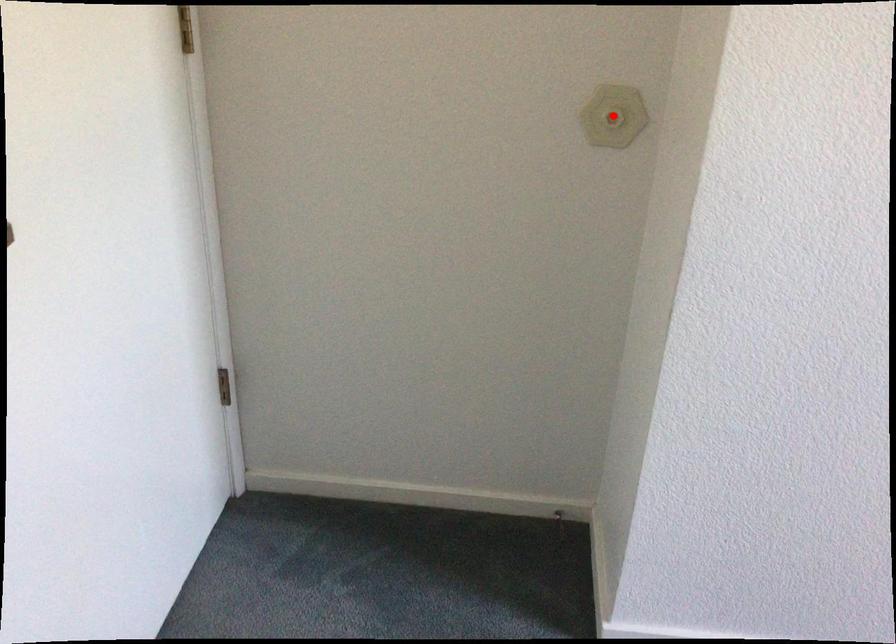
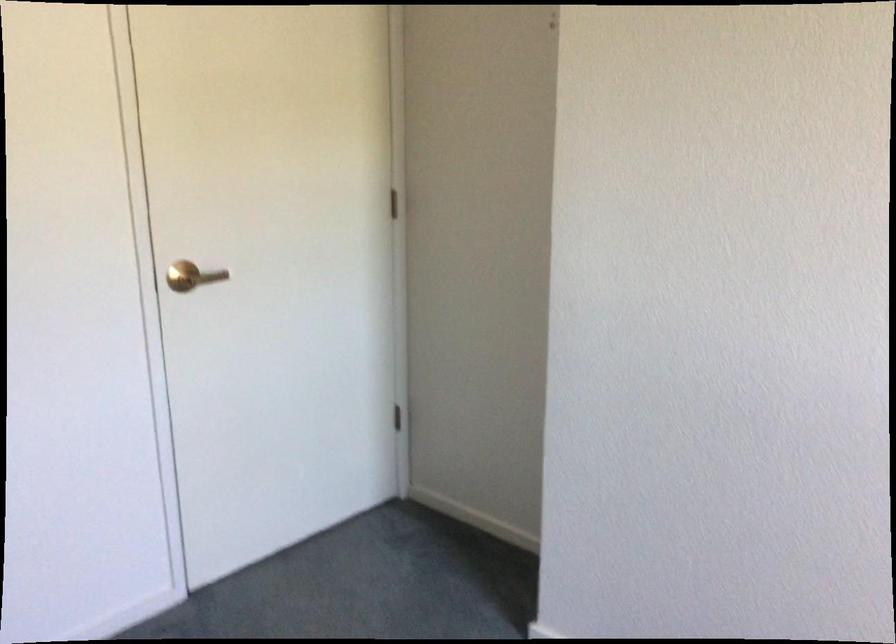
Question: I am providing you with two images of the same scene from different viewpoints. A red point is marked on the first image. At the location where the point appears in image 1, is it still visible in image 2?

Choices:
 (A) Yes
 (B) No

Answer: (B)